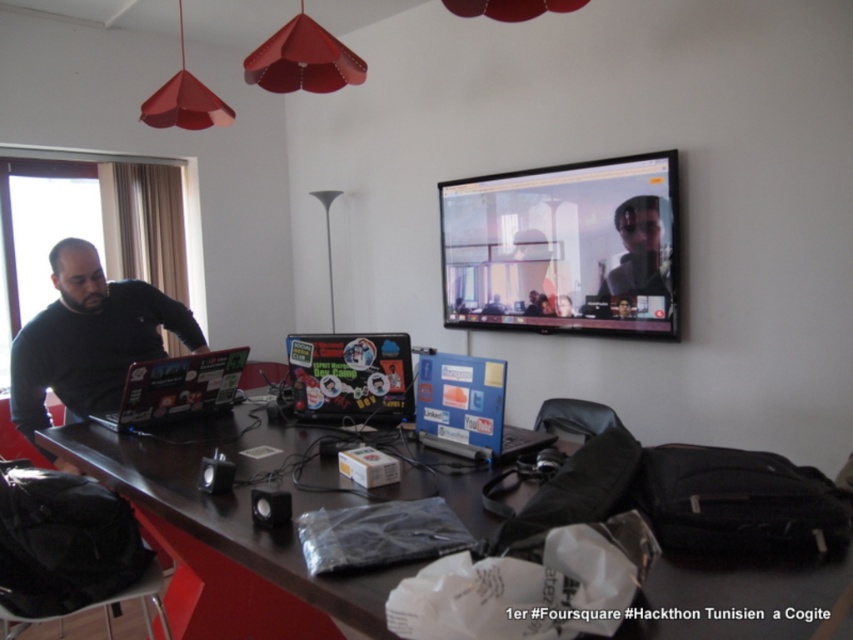
You are setting up a new monitor for a presentation. The black glossy monitor at upper center and the shiny black laptop at left are both on your desk. Which device do you think will occupy more space on the desk?

The black glossy monitor at upper center is larger in size compared to the shiny black laptop at left, so it will occupy more space on the desk.

You are a visitor in the office and want to see the screen of the blue matte laptop at center without moving the person wearing the matte black shirt at upper center. Is this possible?

The blue matte laptop at center is in front of the matte black shirt at upper center, so yes, you can see the screen of the blue matte laptop at center without moving the person wearing the matte black shirt at upper center because it is positioned in front of them.

You are standing in front of the desk and want to place a new laptop between the two points marked as point (672, 211) and point (125, 394). Which point should you use as the reference for the front position of the new laptop?

Point (672, 211) is further to the camera than point (125, 394), so you should use point (125, 394) as the reference for the front position of the new laptop since it is closer to you.